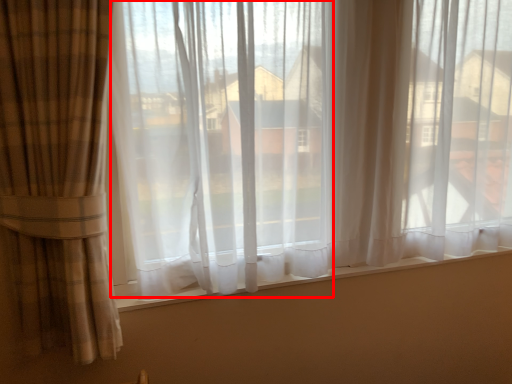
Question: From the image, what is the correct spatial relationship of window screen (annotated by the red box) in relation to window sill?

Choices:
 (A) right
 (B) left

Answer: (A)